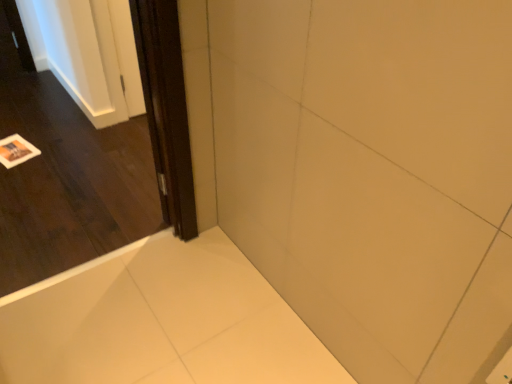
Describe the element at coordinates (166, 109) in the screenshot. I see `dark wood screen door at left` at that location.

At what (x,y) coordinates should I click in order to perform the action: click on dark wood screen door at left. Please return your answer as a coordinate pair (x, y). The width and height of the screenshot is (512, 384). Looking at the image, I should click on (166, 109).

Locate an element on the screen. The height and width of the screenshot is (384, 512). dark wood screen door at left is located at coordinates (166, 109).

Considering their positions, is white glossy bathtub at lower left located in front of or behind dark wood screen door at left?

Clearly, white glossy bathtub at lower left is in front of dark wood screen door at left.

Based on the photo, is white glossy bathtub at lower left surrounding dark wood screen door at left?

That's incorrect, dark wood screen door at left is not inside white glossy bathtub at lower left.

Is point (27, 239) positioned before point (174, 5)?

No.

From a real-world perspective, is dark wood door at left positioned above or below dark wood screen door at left?

In terms of real-world spatial position, dark wood door at left is above dark wood screen door at left.

Considering the sizes of dark wood door at left and dark wood screen door at left in the image, is dark wood door at left bigger or smaller than dark wood screen door at left?

Considering their sizes, dark wood door at left takes up more space than dark wood screen door at left.

Considering the sizes of objects dark wood door at left and white glossy bathtub at lower left in the image provided, who is shorter, dark wood door at left or white glossy bathtub at lower left?

Standing shorter between the two is white glossy bathtub at lower left.

Is dark wood door at left facing towards white glossy bathtub at lower left?

Yes, dark wood door at left is oriented towards white glossy bathtub at lower left.

Can you confirm if dark wood door at left is smaller than white glossy bathtub at lower left?

Incorrect, dark wood door at left is not smaller in size than white glossy bathtub at lower left.

Considering the sizes of dark wood door at left and white glossy bathtub at lower left in the image, is dark wood door at left wider or thinner than white glossy bathtub at lower left?

Considering their sizes, dark wood door at left looks slimmer than white glossy bathtub at lower left.

In the scene shown: Is white glossy bathtub at lower left oriented away from dark wood door at left?

white glossy bathtub at lower left does not have its back to dark wood door at left.

Does white glossy bathtub at lower left lie behind dark wood door at left?

Yes.

Considering the points (243, 310) and (50, 96), which point is behind, point (243, 310) or point (50, 96)?

The point (50, 96) is farther from the camera.

Would you say dark wood screen door at left is a long distance from dark wood door at left?

Actually, dark wood screen door at left and dark wood door at left are a little close together.

Is dark wood screen door at left wider or thinner than dark wood door at left?

dark wood screen door at left is thinner than dark wood door at left.

Looking at this image, in the image, is dark wood screen door at left positioned in front of or behind dark wood door at left?

dark wood screen door at left is positioned farther from the viewer than dark wood door at left.

Considering the sizes of dark wood screen door at left and dark wood door at left in the image, is dark wood screen door at left taller or shorter than dark wood door at left?

Considering their sizes, dark wood screen door at left has less height than dark wood door at left.

Locate an element on the screen. bath located in front of the dark wood screen door at left is located at coordinates (160, 321).

Consider the image. Considering the relative positions of dark wood screen door at left and white glossy bathtub at lower left in the image provided, is dark wood screen door at left in front of white glossy bathtub at lower left?

No, dark wood screen door at left is further to the viewer.

From the image's perspective, is dark wood screen door at left located beneath white glossy bathtub at lower left?

Incorrect, from the image's perspective, dark wood screen door at left is higher than white glossy bathtub at lower left.

Which of these two, dark wood screen door at left or white glossy bathtub at lower left, is thinner?

With smaller width is dark wood screen door at left.

This screenshot has width=512, height=384. What are the coordinates of `bath that is on the right side of dark wood screen door at left` in the screenshot? It's located at 160,321.

Where is `door lying below the dark wood screen door at left (from the image's perspective)`? The height and width of the screenshot is (384, 512). door lying below the dark wood screen door at left (from the image's perspective) is located at coordinates (66, 176).

Estimate the real-world distances between objects in this image. Which object is closer to dark wood door at left, dark wood screen door at left or white glossy bathtub at lower left?

Among the two, white glossy bathtub at lower left is located nearer to dark wood door at left.

From the picture: When comparing their distances from dark wood door at left, does white glossy bathtub at lower left or dark wood screen door at left seem closer?

Among the two, white glossy bathtub at lower left is located nearer to dark wood door at left.

Looking at the image, which one is located further to dark wood screen door at left, dark wood door at left or white glossy bathtub at lower left?

dark wood door at left is further to dark wood screen door at left.

Considering their positions, is dark wood screen door at left positioned closer to white glossy bathtub at lower left than dark wood door at left?

dark wood door at left is positioned closer to the anchor white glossy bathtub at lower left.

Estimate the real-world distances between objects in this image. Which object is further from white glossy bathtub at lower left, dark wood door at left or dark wood screen door at left?

dark wood screen door at left lies further to white glossy bathtub at lower left than the other object.

From the image, which object appears to be nearer to dark wood screen door at left, white glossy bathtub at lower left or dark wood door at left?

Among the two, white glossy bathtub at lower left is located nearer to dark wood screen door at left.

Identify the location of door between dark wood screen door at left and white glossy bathtub at lower left from top to bottom. coord(66,176).